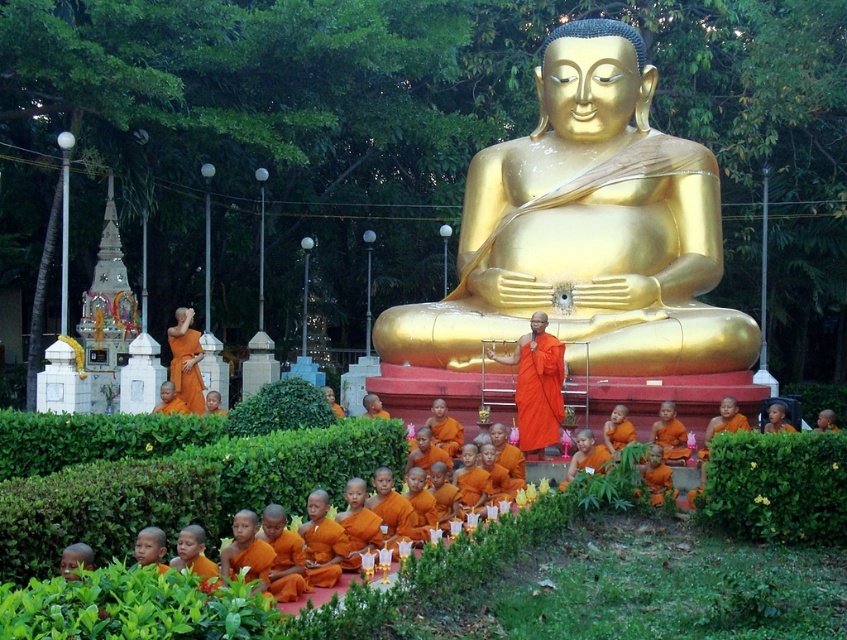
Question: Which object is farther from the camera taking this photo?

Choices:
 (A) green leafy hedge at center
 (B) matte orange robe at lower left
 (C) green leafy hedge at lower right
 (D) gold polished statue at center

Answer: (B)

Question: Does green leafy hedge at center lie behind matte orange robe at lower left?

Choices:
 (A) no
 (B) yes

Answer: (A)

Question: Which is farther from the matte orange robe at lower left?

Choices:
 (A) green leafy hedge at lower right
 (B) orange cloth monk at center
 (C) green leafy hedge at center
 (D) gold polished statue at center

Answer: (A)

Question: Considering the real-world distances, which object is farthest from the orange cloth monk at center?

Choices:
 (A) green leafy hedge at center
 (B) green leafy hedge at lower right
 (C) gold polished statue at center
 (D) matte orange robe at lower left

Answer: (D)

Question: Is gold polished statue at center wider than green leafy hedge at center?

Choices:
 (A) yes
 (B) no

Answer: (A)

Question: Does gold polished statue at center have a lesser width compared to matte orange robe at lower left?

Choices:
 (A) no
 (B) yes

Answer: (A)